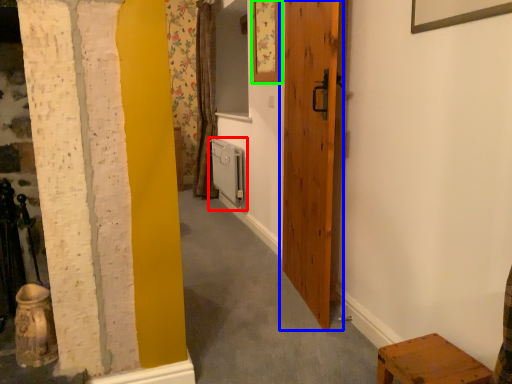
Question: Which object is the farthest from radiator (highlighted by a red box)? Choose among these: door (highlighted by a blue box) or picture frame (highlighted by a green box).

Choices:
 (A) door
 (B) picture frame

Answer: (A)